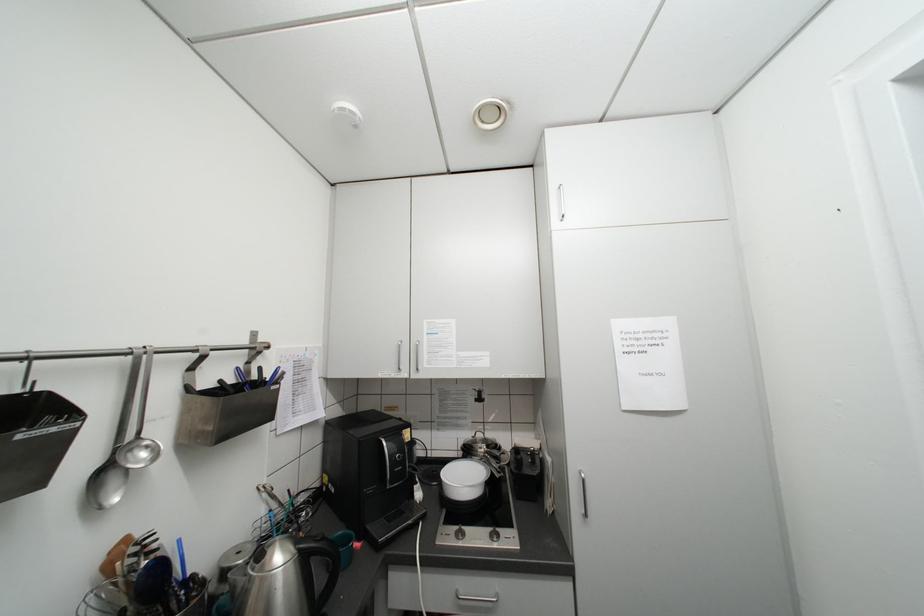
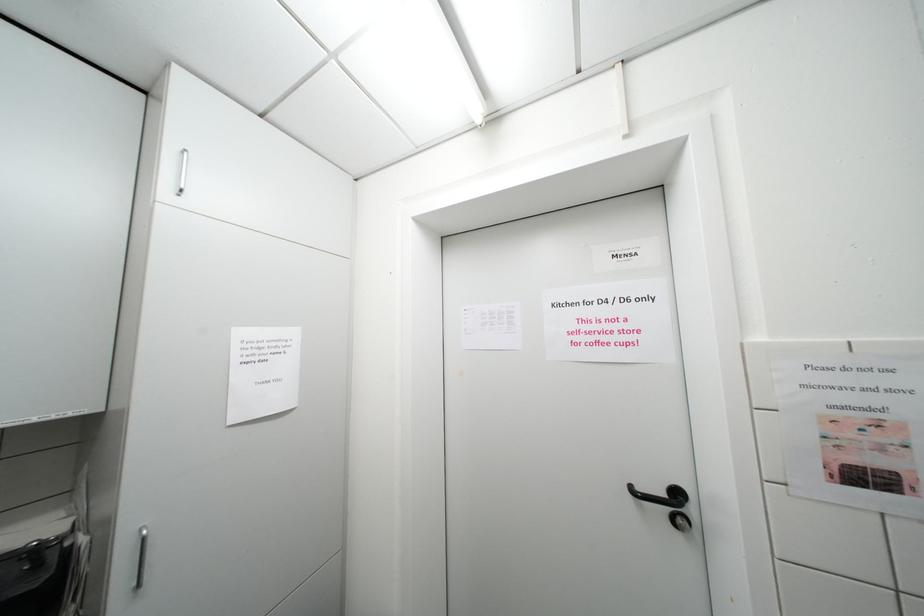
Question: How did the camera likely rotate?

Choices:
 (A) Left
 (B) Right
 (C) Up
 (D) Down

Answer: (B)